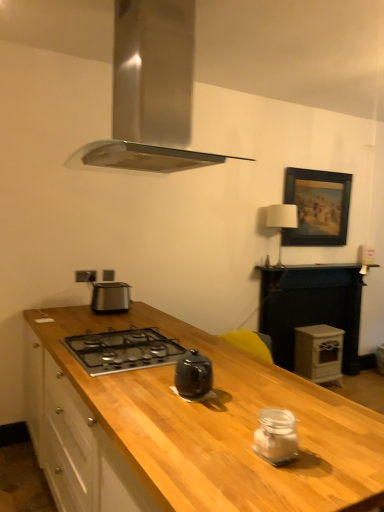
This screenshot has width=384, height=512. What are the coordinates of `vacant space to the left of satin silver toaster at center, the 2th kitchen appliance in the bottom-to-top sequence` in the screenshot? It's located at (79, 309).